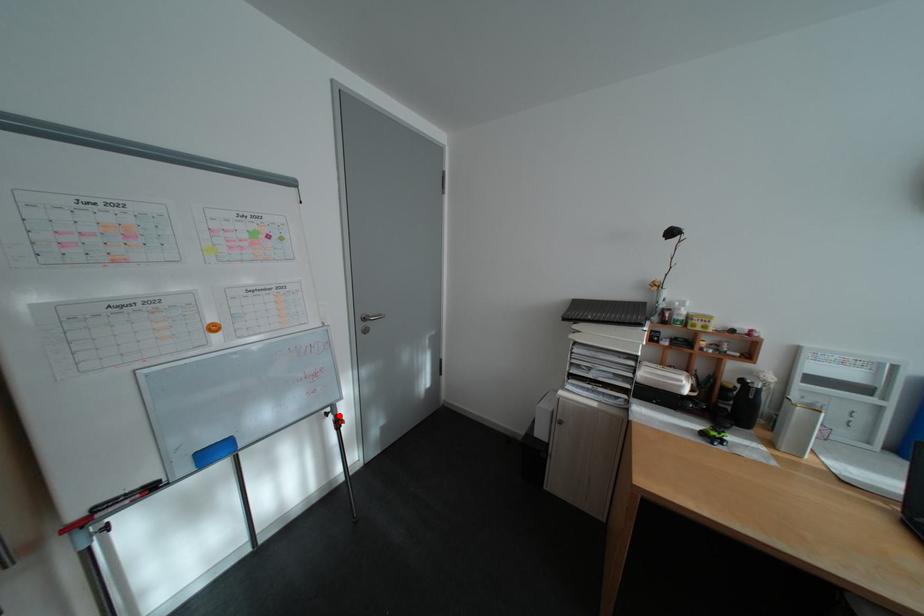
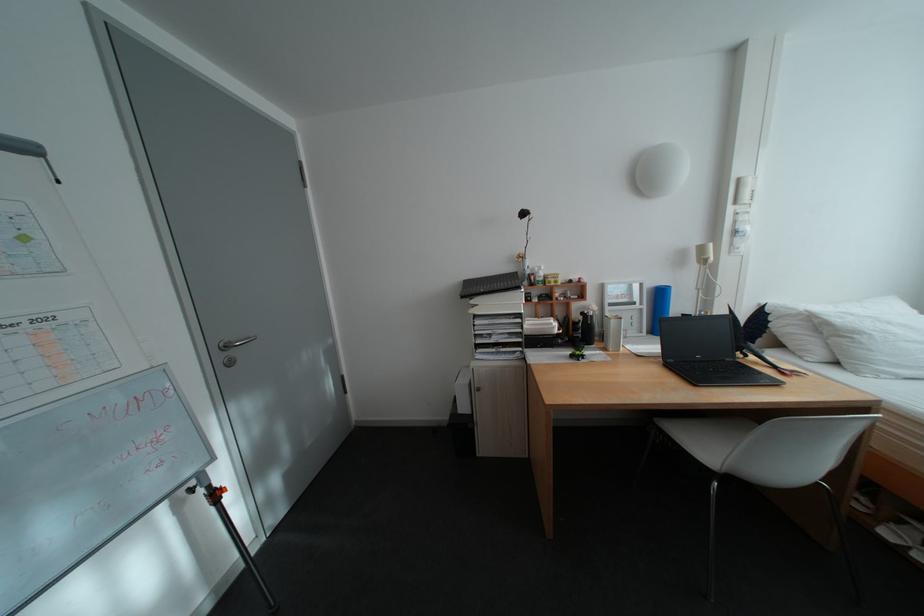
Find the pixel in the second image that matches the highlighted location in the first image.

(203, 492)